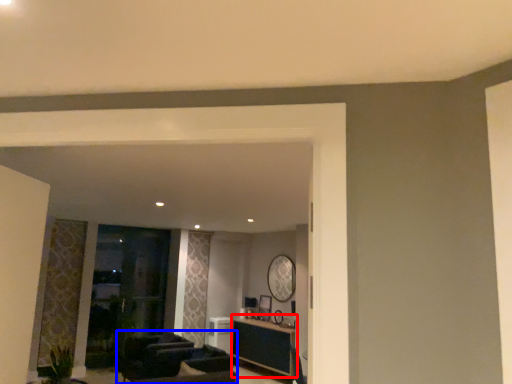
Question: Which object is further to the camera taking this photo, table (highlighted by a red box) or armchair (highlighted by a blue box)?

Choices:
 (A) table
 (B) armchair

Answer: (A)